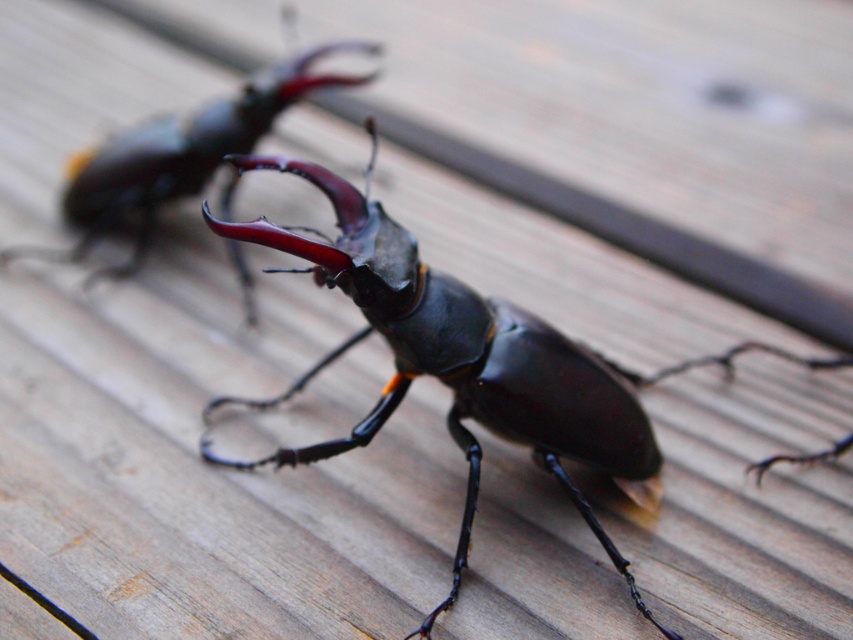
Which is more to the left, shiny black beetle at center or glossy black beetle at center?

From the viewer's perspective, glossy black beetle at center appears more on the left side.

Who is shorter, shiny black beetle at center or glossy black beetle at center?

glossy black beetle at center

The height and width of the screenshot is (640, 853). In order to click on shiny black beetle at center in this screenshot , I will do `click(463, 360)`.